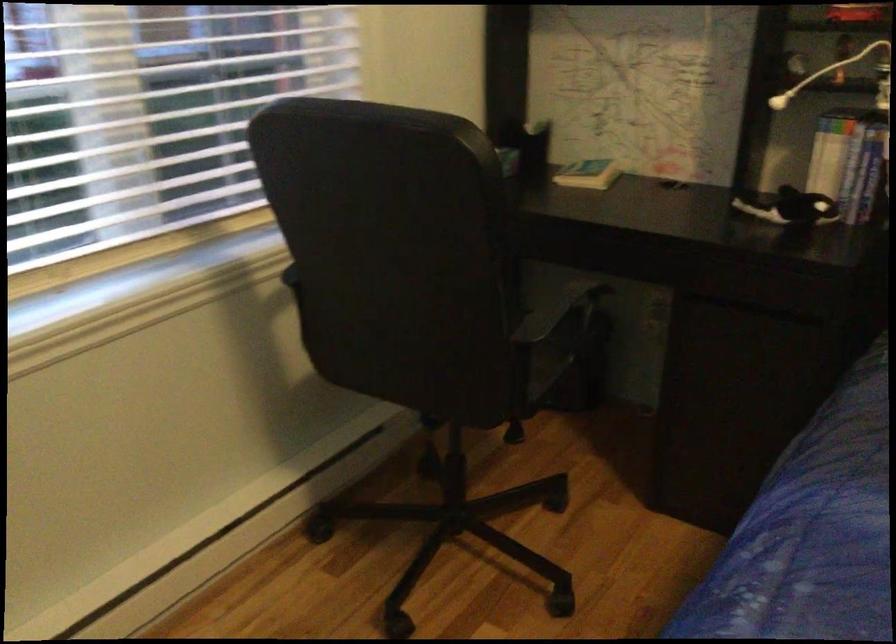
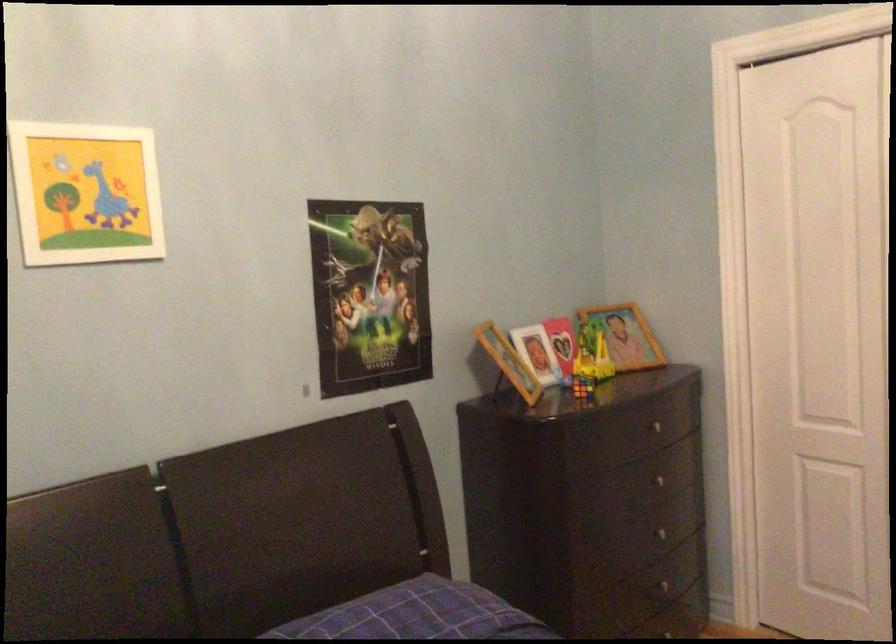
Question: The first image is from the beginning of the video and the second image is from the end. How did the camera likely rotate when shooting the video?

Choices:
 (A) Left
 (B) Right
 (C) Up
 (D) Down

Answer: (B)